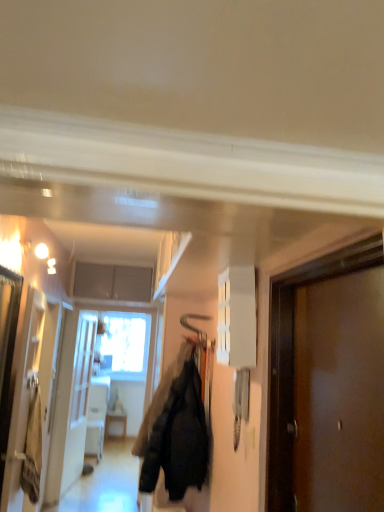
Question: Does velvet black jacket at center have a larger size compared to brown matte door at right?

Choices:
 (A) no
 (B) yes

Answer: (B)

Question: Is velvet black jacket at center positioned beyond the bounds of brown matte door at right?

Choices:
 (A) yes
 (B) no

Answer: (A)

Question: Is velvet black jacket at center further to camera compared to brown matte door at right?

Choices:
 (A) no
 (B) yes

Answer: (B)

Question: From a real-world perspective, is velvet black jacket at center under brown matte door at right?

Choices:
 (A) yes
 (B) no

Answer: (A)

Question: Can you confirm if velvet black jacket at center is positioned to the left of brown matte door at right?

Choices:
 (A) no
 (B) yes

Answer: (B)

Question: From a real-world perspective, is velvet black jacket at center on top of brown matte door at right?

Choices:
 (A) yes
 (B) no

Answer: (B)

Question: Is the depth of brown matte door at right greater than that of white glossy cabinet at upper center?

Choices:
 (A) yes
 (B) no

Answer: (B)

Question: From the image's perspective, is brown matte door at right under white glossy cabinet at upper center?

Choices:
 (A) no
 (B) yes

Answer: (B)

Question: Can you confirm if brown matte door at right is bigger than white glossy cabinet at upper center?

Choices:
 (A) yes
 (B) no

Answer: (A)

Question: Can you confirm if brown matte door at right is thinner than white glossy cabinet at upper center?

Choices:
 (A) yes
 (B) no

Answer: (B)

Question: Is brown matte door at right outside white glossy cabinet at upper center?

Choices:
 (A) yes
 (B) no

Answer: (A)

Question: Considering the relative positions of brown matte door at right and white glossy cabinet at upper center in the image provided, is brown matte door at right in front of white glossy cabinet at upper center?

Choices:
 (A) no
 (B) yes

Answer: (B)

Question: From a real-world perspective, is brown matte door at right located beneath velvet black jacket at center?

Choices:
 (A) no
 (B) yes

Answer: (A)